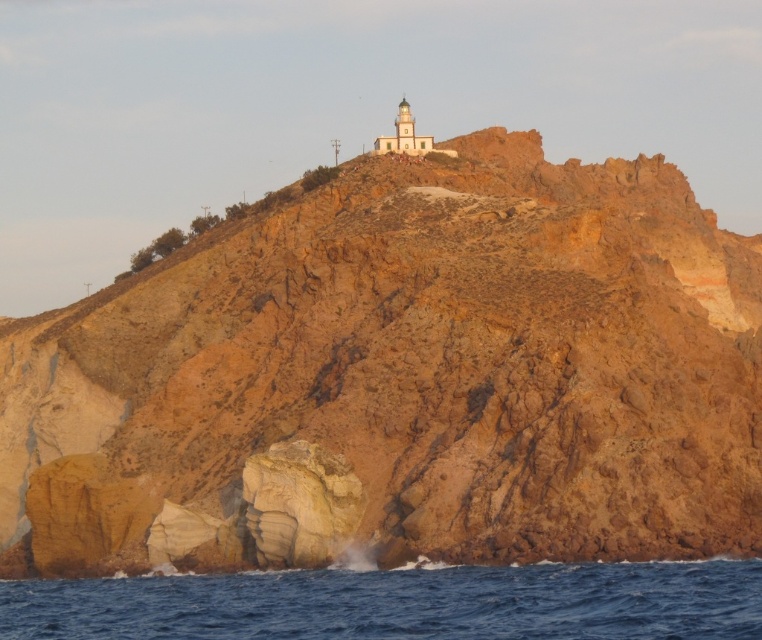
Question: Does rustic rock cliff at upper center appear on the left side of blue water at lower center?

Choices:
 (A) yes
 (B) no

Answer: (B)

Question: Is rustic rock cliff at upper center bigger than blue water at lower center?

Choices:
 (A) no
 (B) yes

Answer: (B)

Question: Can you confirm if rustic rock cliff at upper center is bigger than blue water at lower center?

Choices:
 (A) yes
 (B) no

Answer: (A)

Question: Which point is farther from the camera taking this photo?

Choices:
 (A) (476, 282)
 (B) (485, 620)

Answer: (A)